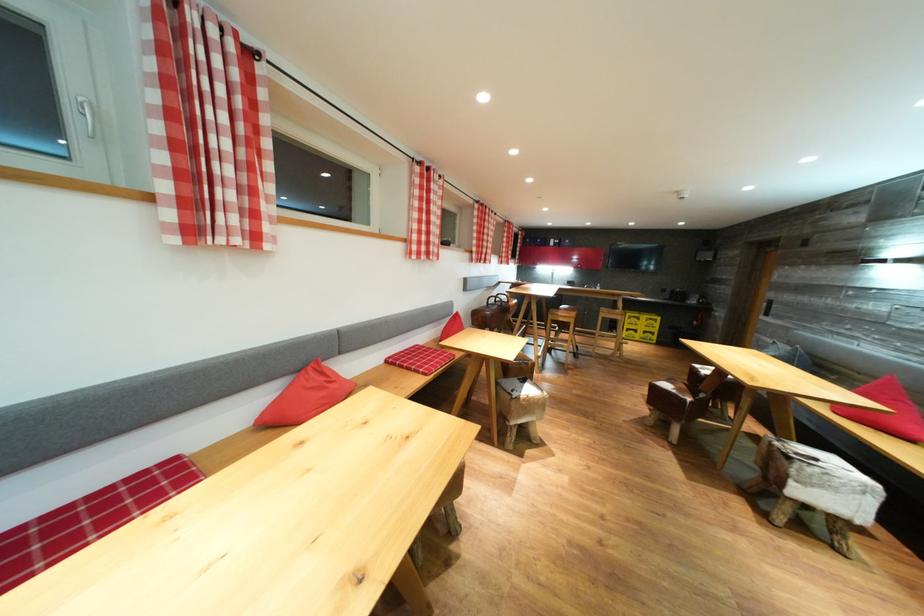
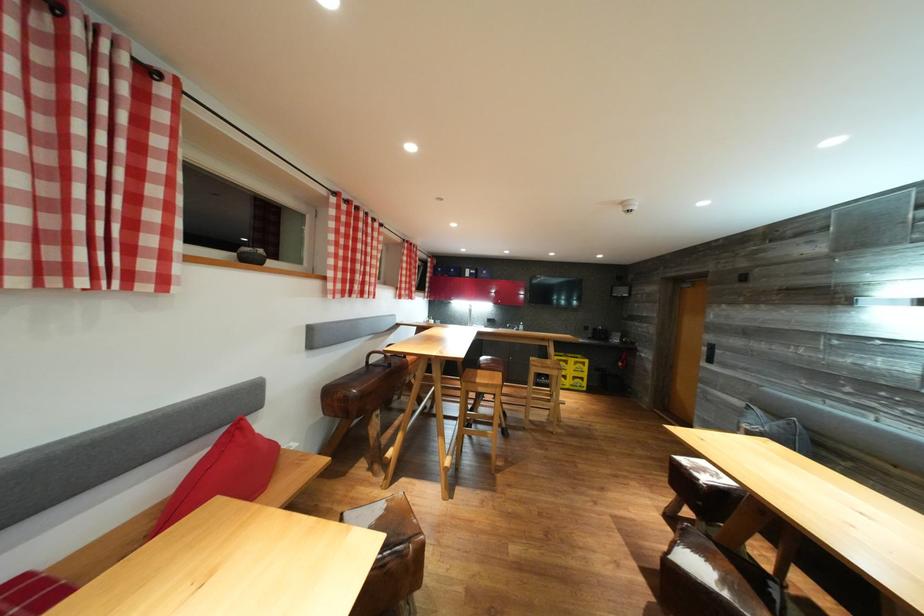
Where in the second image is the point corresponding to the point at 650,323 from the first image?

(578, 366)